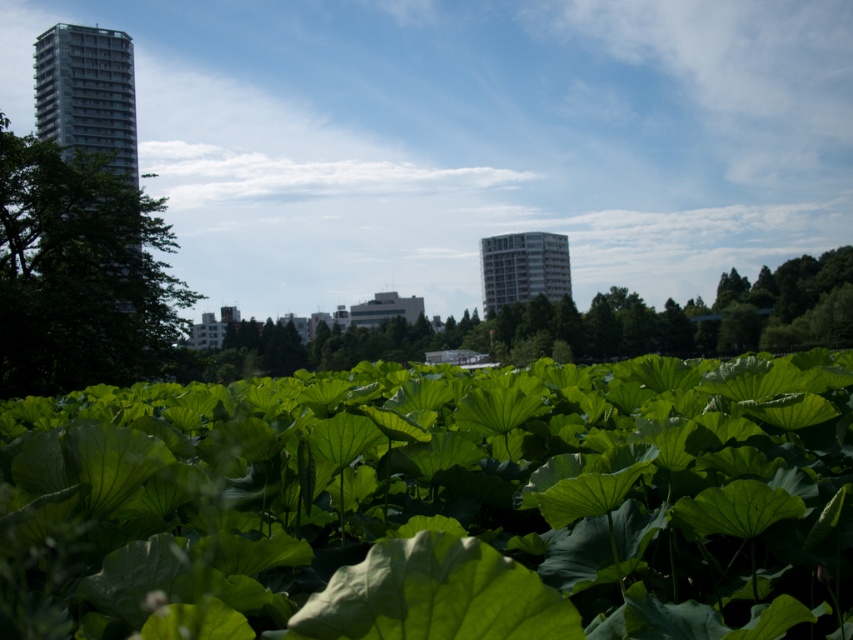
Does green leafy tree at left have a greater width compared to green leafy plant at center?

No.

Does green leafy tree at left have a greater height compared to green leafy plant at center?

No, green leafy tree at left is not taller than green leafy plant at center.

Which is in front, point (88, 298) or point (573, 353)?

Point (88, 298)

This screenshot has height=640, width=853. Find the location of `green leafy tree at left`. green leafy tree at left is located at coordinates (79, 273).